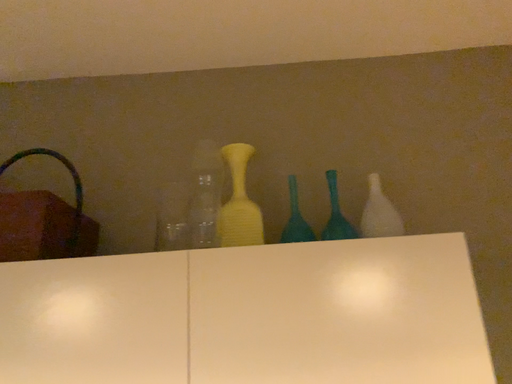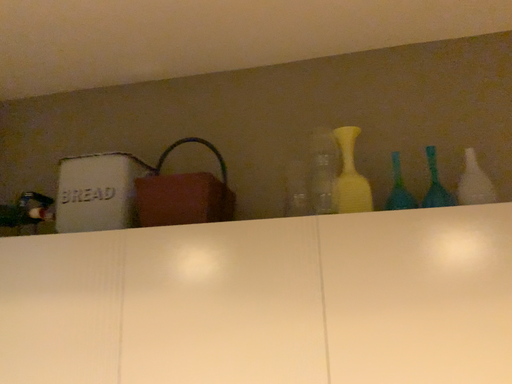
Question: Which way did the camera rotate in the video?

Choices:
 (A) rotated right
 (B) rotated left

Answer: (B)